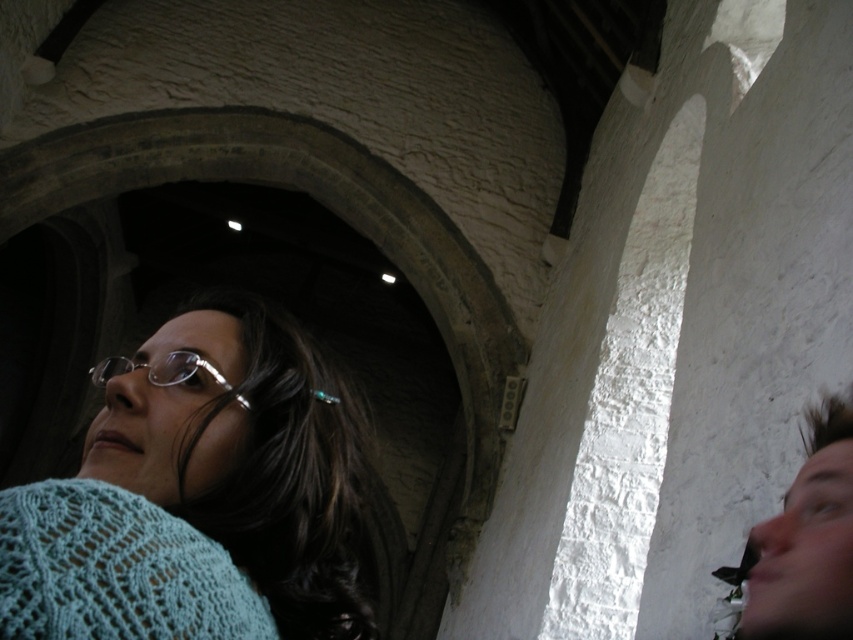
You are standing in the historic building and want to move from point A to point B. Point A is at coordinate point (758, 632) and point B is at coordinate point (242, 403). Which point is closer to you when you first enter the building?

Point A at coordinate point (758, 632) is closer to the viewer than point B at coordinate point (242, 403), so you would first encounter point A when entering the building.

You are standing in the historic building and notice two items of clothing. The knitted light blue sweater at lower left and the silver metallic glasses at center. Which item is positioned more to the right?

The knitted light blue sweater at lower left is positioned more to the right than the silver metallic glasses at center.